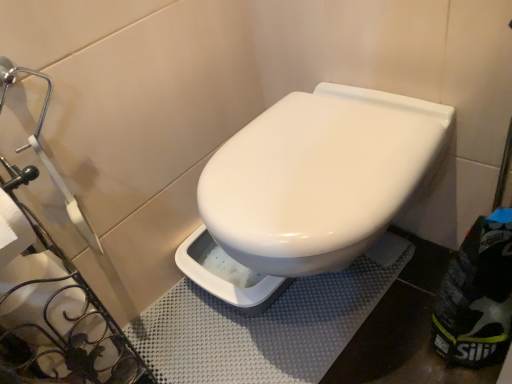
Where is `vacant region above gray textured bath mat at center (from a real-world perspective)`? The image size is (512, 384). vacant region above gray textured bath mat at center (from a real-world perspective) is located at coordinates (263, 316).